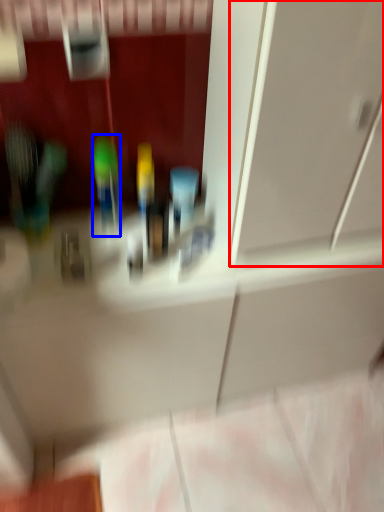
Question: Which of the following is the farthest to the observer, glass door (highlighted by a red box) or toiletry (highlighted by a blue box)?

Choices:
 (A) glass door
 (B) toiletry

Answer: (B)